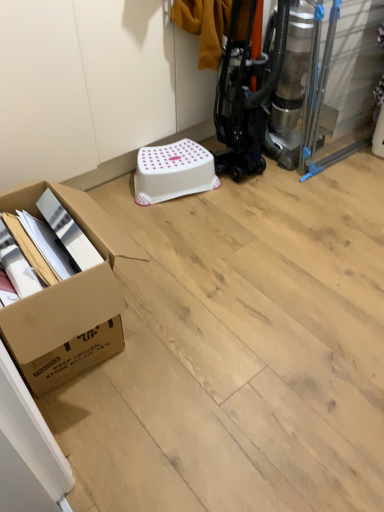
At what (x,y) coordinates should I click in order to perform the action: click on empty space that is to the right of brown cardboard box at lower left. Please return your answer as a coordinate pair (x, y). The height and width of the screenshot is (512, 384). Looking at the image, I should click on (214, 321).